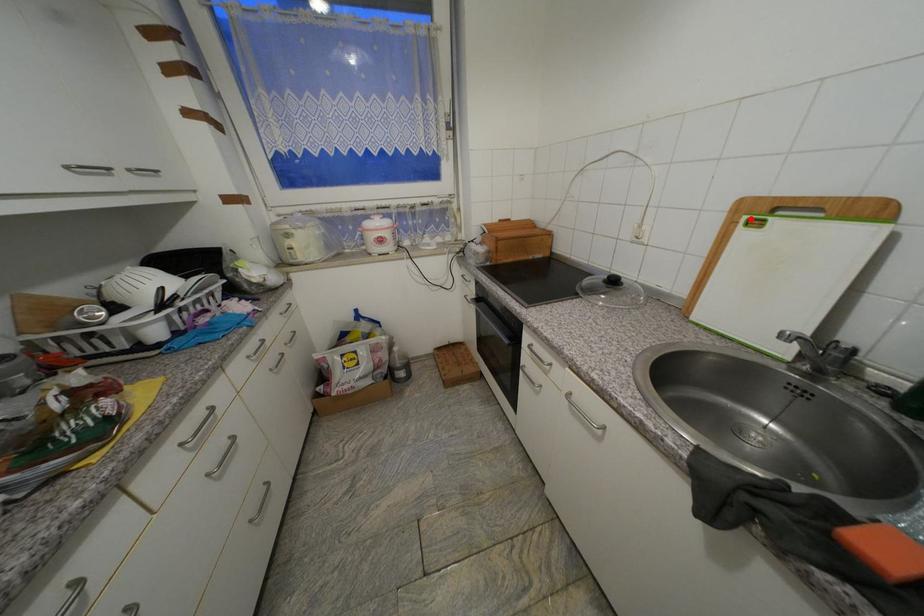
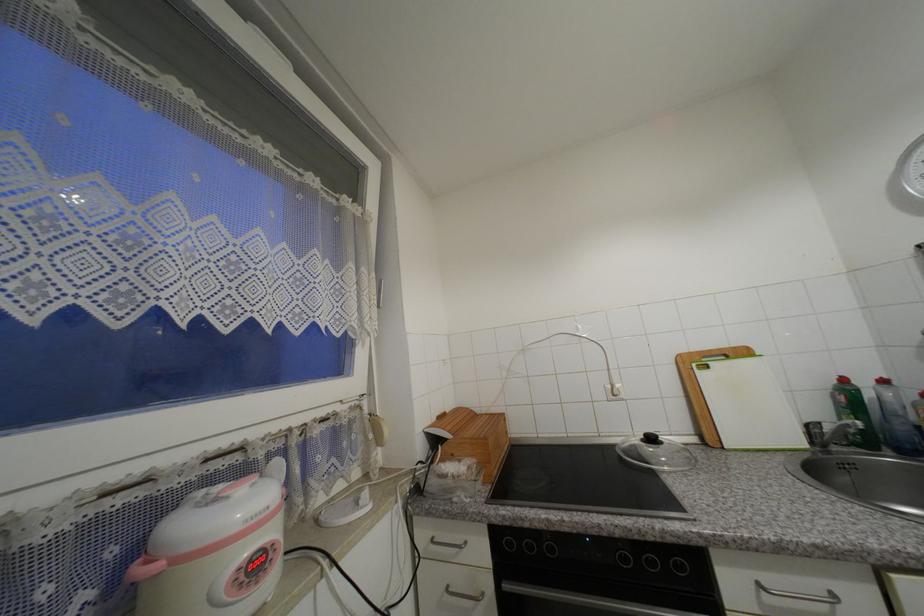
Where in the second image is the point corresponding to the highlighted location from the first image?

(699, 367)